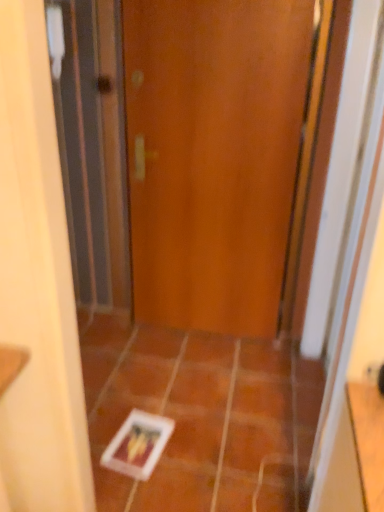
Question: Does wooden door at center come behind white glossy tile at center, which is the second ceramic tile in right-to-left order?

Choices:
 (A) yes
 (B) no

Answer: (A)

Question: Is wooden door at center next to white glossy tile at center, which is the second ceramic tile in right-to-left order, and touching it?

Choices:
 (A) yes
 (B) no

Answer: (B)

Question: Does wooden door at center have a greater width compared to white glossy tile at center, arranged as the 1th ceramic tile when viewed from the left?

Choices:
 (A) no
 (B) yes

Answer: (A)

Question: Considering the relative positions of wooden door at center and white glossy tile at center, which is the second ceramic tile in right-to-left order, in the image provided, is wooden door at center to the left of white glossy tile at center, which is the second ceramic tile in right-to-left order, from the viewer's perspective?

Choices:
 (A) no
 (B) yes

Answer: (A)

Question: Is wooden door at center outside of white glossy tile at center, arranged as the 1th ceramic tile when viewed from the left?

Choices:
 (A) no
 (B) yes

Answer: (B)

Question: From a real-world perspective, is wooden door at center located beneath white glossy tile at center, arranged as the 1th ceramic tile when viewed from the left?

Choices:
 (A) no
 (B) yes

Answer: (A)

Question: Would you say wooden door at center is part of white glossy tile at center, arranged as the 1th ceramic tile when viewed from the left,'s contents?

Choices:
 (A) yes
 (B) no

Answer: (B)

Question: Is white glossy tile at center, arranged as the 1th ceramic tile when viewed from the left, oriented towards wooden door at center?

Choices:
 (A) yes
 (B) no

Answer: (B)

Question: From the image's perspective, is white glossy tile at center, which is the second ceramic tile in right-to-left order, over wooden door at center?

Choices:
 (A) no
 (B) yes

Answer: (A)

Question: Does white glossy tile at center, which is the second ceramic tile in right-to-left order, appear on the right side of wooden door at center?

Choices:
 (A) yes
 (B) no

Answer: (B)

Question: Is white glossy tile at center, which is the second ceramic tile in right-to-left order, not near wooden door at center?

Choices:
 (A) yes
 (B) no

Answer: (B)

Question: Is white glossy tile at center, which is the second ceramic tile in right-to-left order, at the left side of wooden door at center?

Choices:
 (A) no
 (B) yes

Answer: (B)

Question: Is wooden door at center to the right of orange matte tile at center, the 2th ceramic tile positioned from the left, from the viewer's perspective?

Choices:
 (A) yes
 (B) no

Answer: (B)